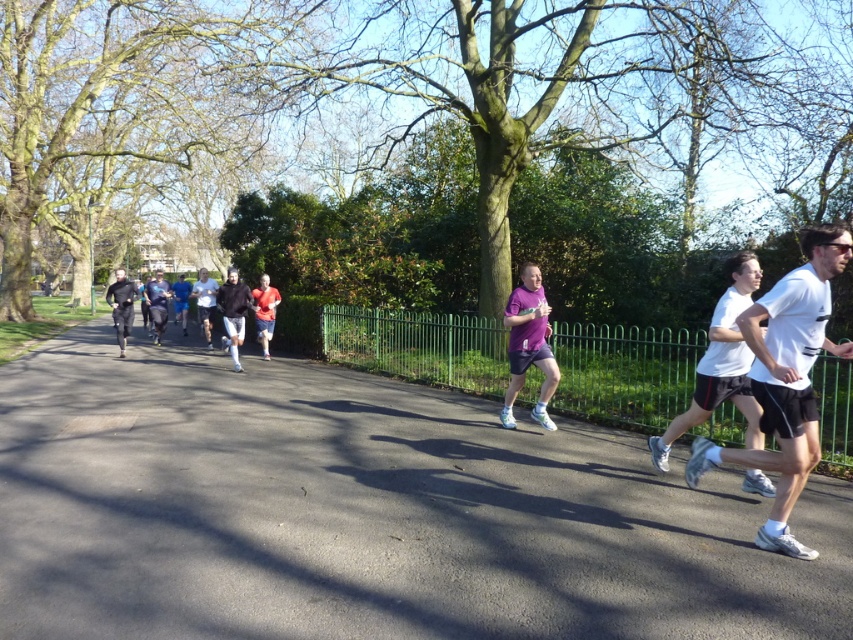
Between point (231, 333) and point (213, 308), which one is positioned behind?

Point (213, 308)

Is point (200, 298) farther from camera compared to point (206, 307)?

No, it is in front of (206, 307).

At what (x,y) coordinates should I click in order to perform the action: click on dark gray running attire at center. Please return your answer as a coordinate pair (x, y). Looking at the image, I should click on (229, 308).

Who is lower down, white matte shorts at center or dark gray running attire at center?

Positioned lower is white matte shorts at center.

What do you see at coordinates (786, 380) in the screenshot?
I see `white matte shorts at center` at bounding box center [786, 380].

Which is behind, point (782, 540) or point (209, 346)?

The point (209, 346) is more distant.

Identify the location of white matte shorts at center. This screenshot has height=640, width=853. (786, 380).

Is asphalt road at center closer to camera compared to white matte shirt at center?

Yes, asphalt road at center is closer to the viewer.

Does asphalt road at center come behind white matte shirt at center?

No, asphalt road at center is in front of white matte shirt at center.

Does point (287, 496) lie behind point (212, 280)?

No, (287, 496) is closer to viewer.

Find the location of a particular element. The width and height of the screenshot is (853, 640). asphalt road at center is located at coordinates (366, 513).